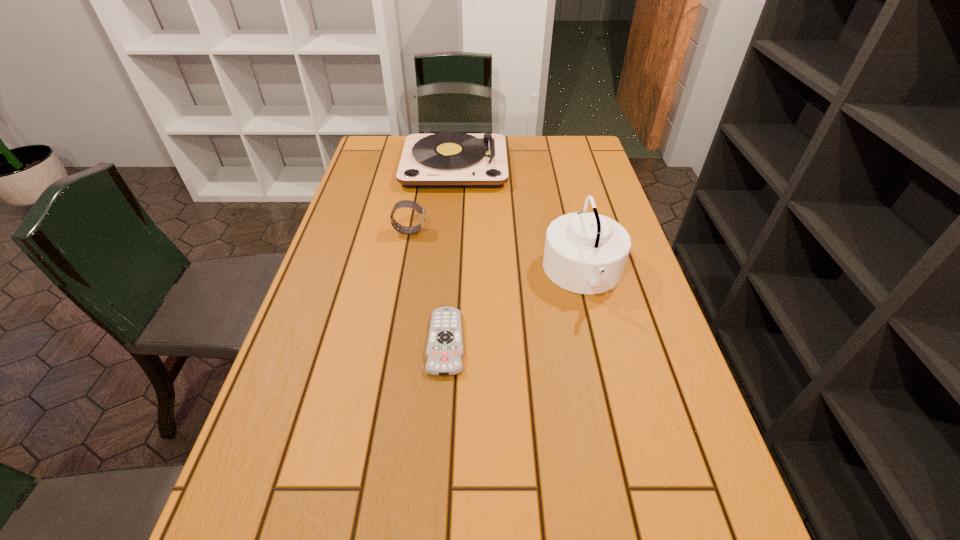
Identify which object is the third closest to the remote control. Please provide its 2D coordinates. Your answer should be formatted as a tuple, i.e. [(x, y)], where the tuple contains the x and y coordinates of a point satisfying the conditions above.

[(450, 159)]

At what (x,y) coordinates should I click in order to perform the action: click on vacant space that satisfies the following two spatial constraints: 1. with the tonearm facing the front of the farthest object; 2. on the face of the third tallest object. Please return your answer as a coordinate pair (x, y). The image size is (960, 540). Looking at the image, I should click on (449, 231).

At what (x,y) coordinates should I click in order to perform the action: click on free space that satisfies the following two spatial constraints: 1. with the tonearm facing the front of the shortest object; 2. on the left side of the record player. Please return your answer as a coordinate pair (x, y). This screenshot has height=540, width=960. Looking at the image, I should click on (441, 342).